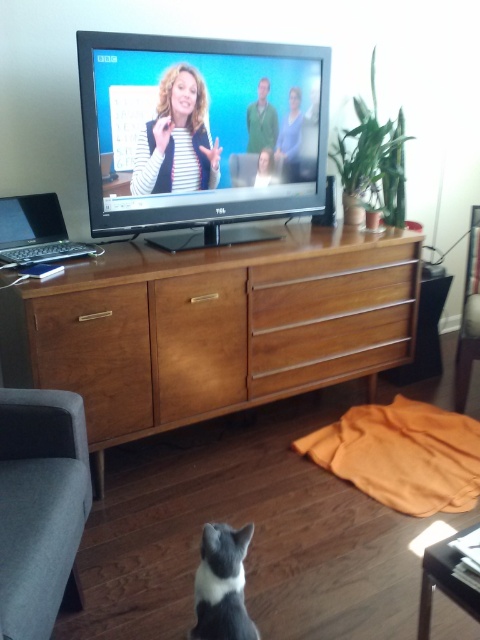
Question: Is matte black vest at upper center closer to camera compared to silver metallic laptop at left?

Choices:
 (A) no
 (B) yes

Answer: (A)

Question: Among these points, which one is farthest from the camera?

Choices:
 (A) (142, 256)
 (B) (4, 241)
 (C) (295, 93)
 (D) (57, 422)

Answer: (C)

Question: Which object is closer to the camera taking this photo?

Choices:
 (A) brown wood entertainment center at center
 (B) silver metallic laptop at left

Answer: (A)

Question: Can you confirm if gray fabric armchair at lower left is bigger than matte black vest at upper center?

Choices:
 (A) yes
 (B) no

Answer: (A)

Question: Which point is farther from the camera taking this photo?

Choices:
 (A) (239, 115)
 (B) (24, 595)
 (C) (38, 221)
 (D) (143, 132)

Answer: (A)

Question: Is matte black vest at upper center to the left of black and white fur cat at lower center from the viewer's perspective?

Choices:
 (A) yes
 (B) no

Answer: (A)